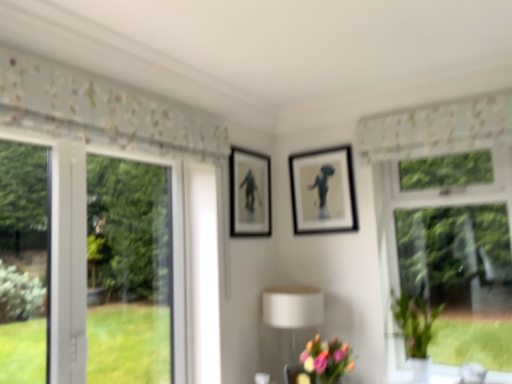
Question: From the image's perspective, is green glossy vase at right below white floral fabric at upper center?

Choices:
 (A) no
 (B) yes

Answer: (B)

Question: Is green glossy vase at right to the right of white floral fabric at upper center from the viewer's perspective?

Choices:
 (A) no
 (B) yes

Answer: (A)

Question: Does green glossy vase at right touch white floral fabric at upper center?

Choices:
 (A) yes
 (B) no

Answer: (B)

Question: Considering the relative sizes of green glossy vase at right and white floral fabric at upper center in the image provided, is green glossy vase at right taller than white floral fabric at upper center?

Choices:
 (A) no
 (B) yes

Answer: (B)

Question: Is green glossy vase at right looking in the opposite direction of white floral fabric at upper center?

Choices:
 (A) yes
 (B) no

Answer: (B)

Question: Looking at their shapes, would you say white matte table lamp at lower center is wider or thinner than pastel bouquet at lower center?

Choices:
 (A) wide
 (B) thin

Answer: (A)

Question: In the image, is white matte table lamp at lower center positioned in front of or behind pastel bouquet at lower center?

Choices:
 (A) behind
 (B) front

Answer: (A)

Question: From the image's perspective, is white matte table lamp at lower center located above or below pastel bouquet at lower center?

Choices:
 (A) below
 (B) above

Answer: (B)

Question: Would you say white matte table lamp at lower center is inside or outside pastel bouquet at lower center?

Choices:
 (A) inside
 (B) outside

Answer: (B)

Question: From the image's perspective, is white matte table lamp at lower center positioned above or below black matte picture frame at center, which is counted as the second picture frame, starting from the right?

Choices:
 (A) below
 (B) above

Answer: (A)

Question: Considering the positions of white matte table lamp at lower center and black matte picture frame at center, which is counted as the 1th picture frame, starting from the left, in the image, is white matte table lamp at lower center taller or shorter than black matte picture frame at center, which is counted as the 1th picture frame, starting from the left,?

Choices:
 (A) short
 (B) tall

Answer: (B)

Question: Would you say white matte table lamp at lower center is to the left or to the right of black matte picture frame at center, which is counted as the second picture frame, starting from the right, in the picture?

Choices:
 (A) left
 (B) right

Answer: (B)

Question: Based on their sizes in the image, would you say white matte table lamp at lower center is bigger or smaller than black matte picture frame at center, which is counted as the second picture frame, starting from the right?

Choices:
 (A) small
 (B) big

Answer: (B)

Question: In terms of width, does pastel bouquet at lower center look wider or thinner when compared to black matte picture frame at center, which is counted as the second picture frame, starting from the right?

Choices:
 (A) thin
 (B) wide

Answer: (B)

Question: Is pastel bouquet at lower center situated inside black matte picture frame at center, which is counted as the 1th picture frame, starting from the left, or outside?

Choices:
 (A) outside
 (B) inside

Answer: (A)